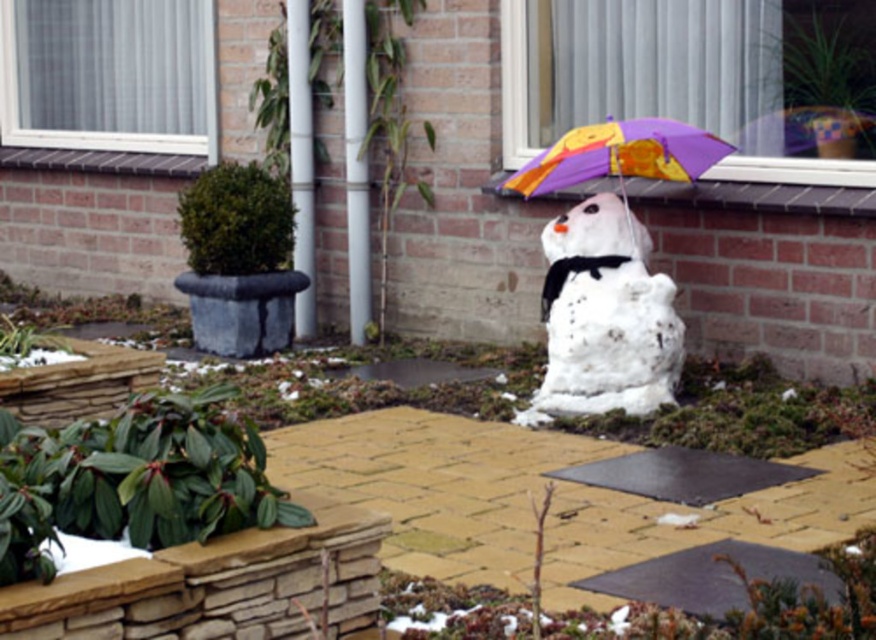
Question: Does white fluffy snowman at center have a lesser width compared to purple fabric umbrella at upper center?

Choices:
 (A) no
 (B) yes

Answer: (A)

Question: Does white fluffy snowman at center appear on the left side of matte plastic umbrella at center?

Choices:
 (A) no
 (B) yes

Answer: (B)

Question: Considering the real-world distances, which object is closest to the white fluffy snowman at center?

Choices:
 (A) purple fabric umbrella at upper center
 (B) matte plastic umbrella at center

Answer: (B)

Question: Is matte plastic umbrella at center further to the viewer compared to purple fabric umbrella at upper center?

Choices:
 (A) yes
 (B) no

Answer: (B)

Question: Which of the following is the farthest from the observer?

Choices:
 (A) (602, 173)
 (B) (643, 328)

Answer: (A)

Question: Which of the following is the farthest from the observer?

Choices:
 (A) purple fabric umbrella at upper center
 (B) white fluffy snowman at center
 (C) matte plastic umbrella at center

Answer: (A)